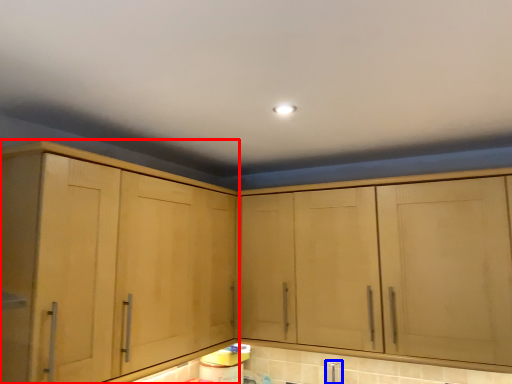
Question: Which object appears closest to the camera in this image, cabinetry (highlighted by a red box) or faucet (highlighted by a blue box)?

Choices:
 (A) cabinetry
 (B) faucet

Answer: (A)